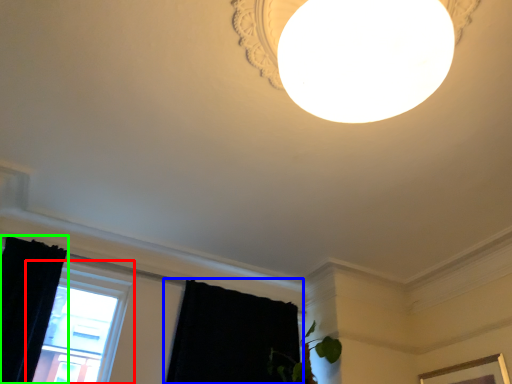
Question: Which object is the farthest from window (highlighted by a red box)? Choose among these: curtain (highlighted by a blue box) or curtain (highlighted by a green box).

Choices:
 (A) curtain
 (B) curtain

Answer: (A)